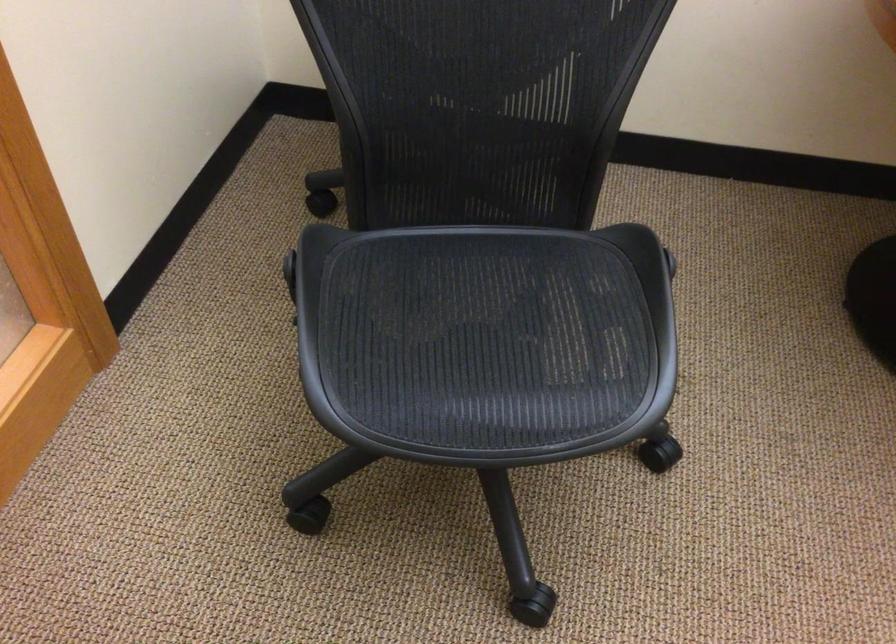
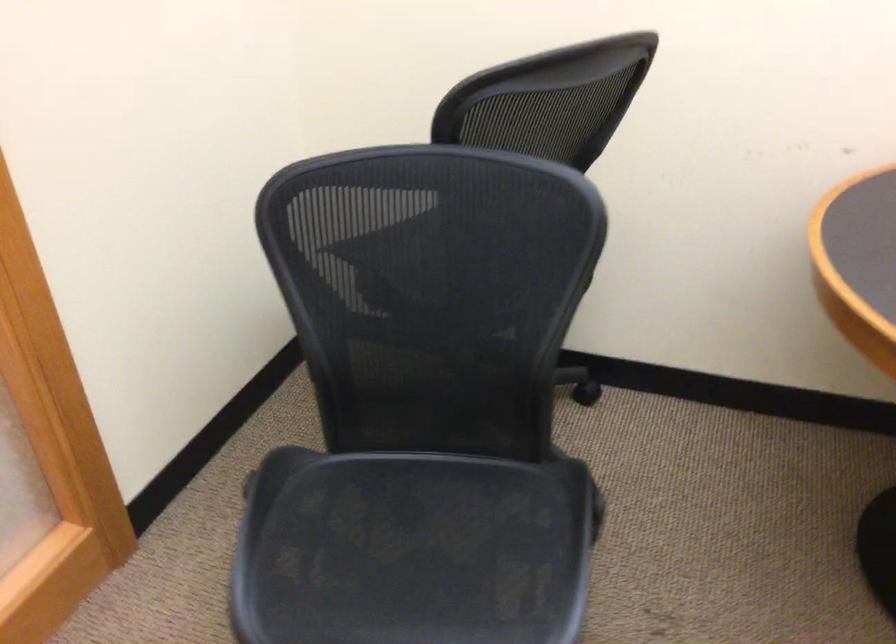
Question: How did the camera likely rotate?

Choices:
 (A) Left
 (B) Right
 (C) Up
 (D) Down

Answer: (C)